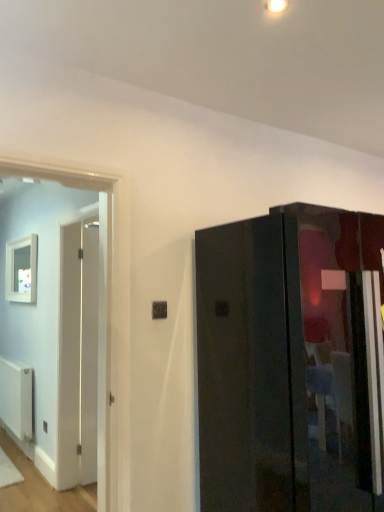
Question: In the image, is black plastic electric outlet at center positioned in front of or behind white matte picture frame at left?

Choices:
 (A) front
 (B) behind

Answer: (A)

Question: Is black plastic electric outlet at center to the left or to the right of white matte picture frame at left in the image?

Choices:
 (A) left
 (B) right

Answer: (B)

Question: Based on their relative distances, which object is nearer to the black plastic electric outlet at center?

Choices:
 (A) white matte radiator at lower left
 (B) glossy black cabinet at right
 (C) white matte picture frame at left

Answer: (B)

Question: Estimate the real-world distances between objects in this image. Which object is farther from the black plastic electric outlet at center?

Choices:
 (A) glossy black cabinet at right
 (B) white matte radiator at lower left
 (C) white matte picture frame at left

Answer: (B)